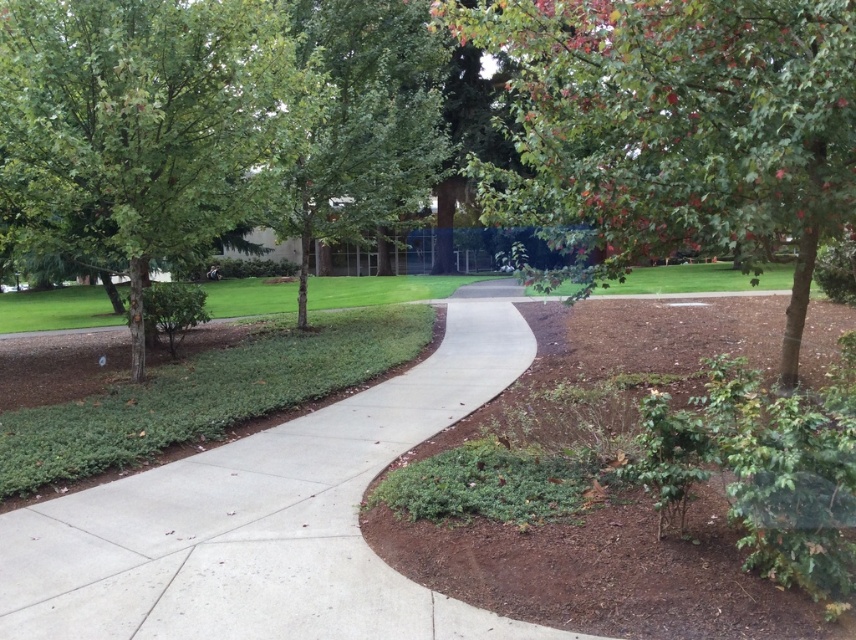
Question: Based on their relative distances, which object is farther from the green leafy grass at lower left?

Choices:
 (A) green grass at center
 (B) green leafy tree at center
 (C) green leafy tree at upper right
 (D) concrete at center

Answer: (A)

Question: Can you confirm if green leafy tree at upper right is positioned below concrete at center?

Choices:
 (A) no
 (B) yes

Answer: (A)

Question: Where is green leafy tree at left located in relation to green leafy tree at center in the image?

Choices:
 (A) below
 (B) above

Answer: (A)

Question: Which of the following is the farthest from the observer?

Choices:
 (A) concrete at center
 (B) green leafy grass at lower left
 (C) green grass at center

Answer: (C)

Question: Among these points, which one is farthest from the camera?

Choices:
 (A) (51, 316)
 (B) (308, 378)
 (C) (159, 241)
 (D) (64, 618)

Answer: (A)

Question: Can you confirm if green leafy tree at upper right is positioned to the left of green leafy tree at center?

Choices:
 (A) no
 (B) yes

Answer: (A)